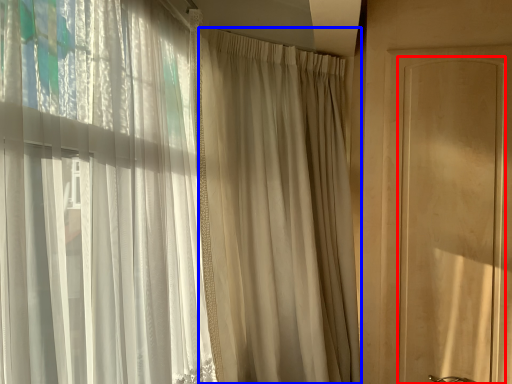
Question: Among these objects, which one is nearest to the camera, screen door (highlighted by a red box) or curtain (highlighted by a blue box)?

Choices:
 (A) screen door
 (B) curtain

Answer: (B)